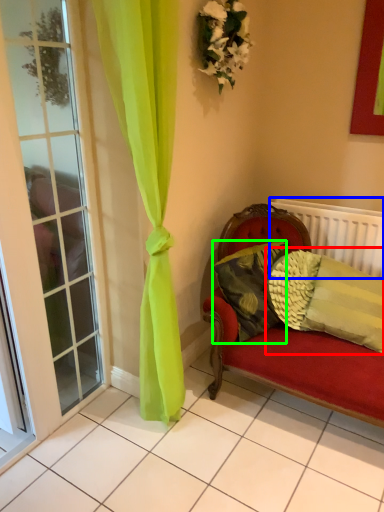
Question: Which object is the closest to the pillow (highlighted by a red box)? Choose among these: radiator (highlighted by a blue box) or pillow (highlighted by a green box).

Choices:
 (A) radiator
 (B) pillow

Answer: (B)